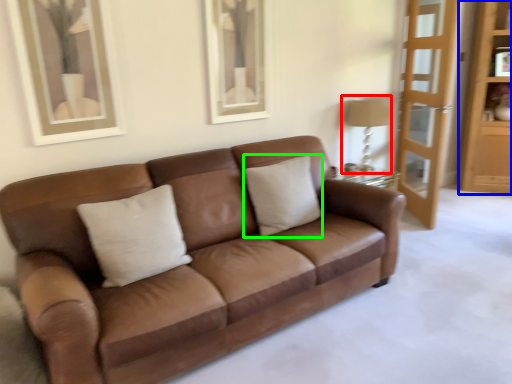
Question: Which object is the farthest from table lamp (highlighted by a red box)? Choose among these: dresser (highlighted by a blue box) or pillow (highlighted by a green box).

Choices:
 (A) dresser
 (B) pillow

Answer: (A)